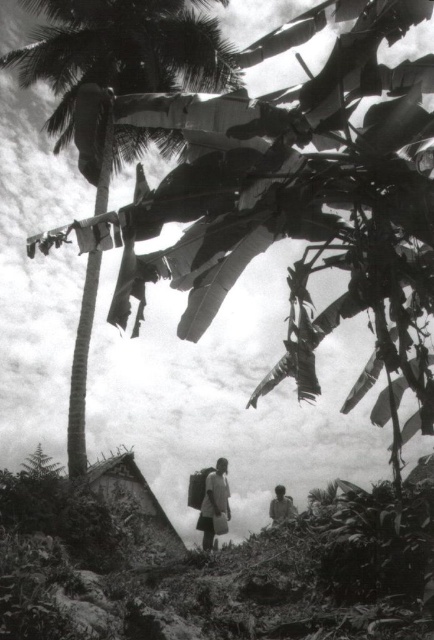
Does matte white backpack at center appear on the left side of light brown fabric shirt at lower right?

Indeed, matte white backpack at center is positioned on the left side of light brown fabric shirt at lower right.

Is point (220, 474) farther from viewer compared to point (288, 516)?

That is True.

Does point (213, 515) come farther from viewer compared to point (272, 502)?

No, it is in front of (272, 502).

Identify the location of matte white backpack at center. [x=214, y=504].

Is smooth brown palm tree at center positioned in front of matte white backpack at center?

Yes, smooth brown palm tree at center is in front of matte white backpack at center.

Which is above, smooth brown palm tree at center or matte white backpack at center?

Positioned higher is smooth brown palm tree at center.

Which is in front, point (91, 36) or point (209, 540)?

Point (209, 540) is in front.

Where is `smooth brown palm tree at center`? Image resolution: width=434 pixels, height=640 pixels. smooth brown palm tree at center is located at coordinates (118, 68).

Can you confirm if smooth brown palm tree at center is positioned above light brown fabric shirt at lower right?

Correct, smooth brown palm tree at center is located above light brown fabric shirt at lower right.

Who is more forward, (119, 51) or (280, 506)?

Point (280, 506) is in front.

Locate an element on the screen. Image resolution: width=434 pixels, height=640 pixels. smooth brown palm tree at center is located at coordinates (118, 68).